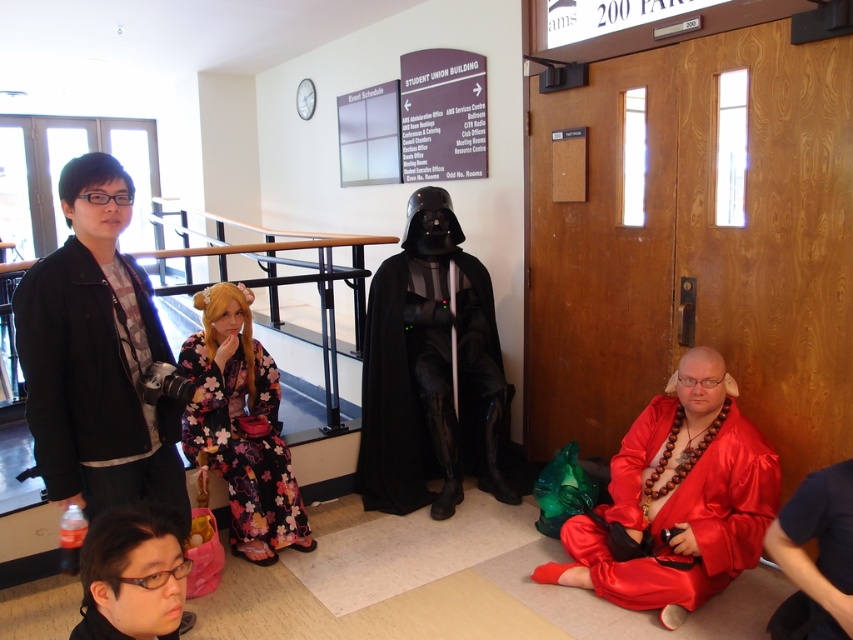
You are organizing a costume party and need to decide which outfit to take with you. The satin red kimono at lower right and the black matte jacket at left are both available. Which one would you choose if you want something larger?

The satin red kimono at lower right is bigger than the black matte jacket at left, so you should choose the satin red kimono at lower right for a larger outfit.

Based on the scene description, where exactly is the floral kimono at center located in the image?

The floral kimono at center is located at point [241,426].